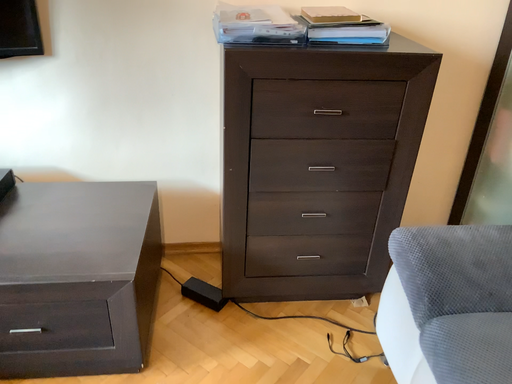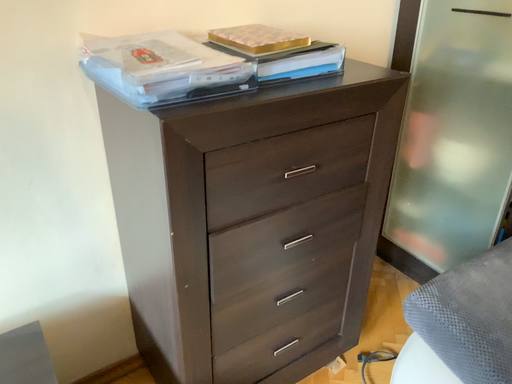
Question: Which way did the camera rotate in the video?

Choices:
 (A) rotated right
 (B) rotated left

Answer: (A)